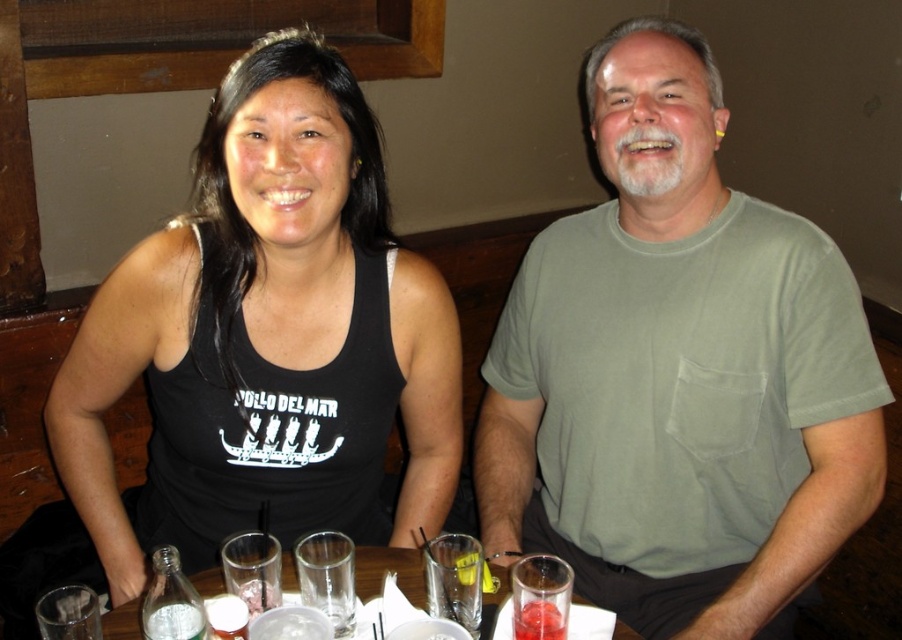
Question: Does black tank top at center lie in front of clear glassware at center?

Choices:
 (A) yes
 (B) no

Answer: (B)

Question: Among these points, which one is farthest from the camera?

Choices:
 (A) (560, 627)
 (B) (131, 609)
 (C) (208, 154)
 (D) (772, 596)

Answer: (C)

Question: Which point is farther from the camera taking this photo?

Choices:
 (A) (578, 301)
 (B) (183, 628)
 (C) (459, 557)
 (D) (551, 618)

Answer: (A)

Question: Does green cotton t-shirt at center appear over yellow translucent jelly at center?

Choices:
 (A) yes
 (B) no

Answer: (A)

Question: Observing the image, what is the correct spatial positioning of black tank top at center in reference to clear glassware at center?

Choices:
 (A) right
 (B) left

Answer: (B)

Question: Among these points, which one is nearest to the camera?

Choices:
 (A) (113, 627)
 (B) (597, 216)

Answer: (A)